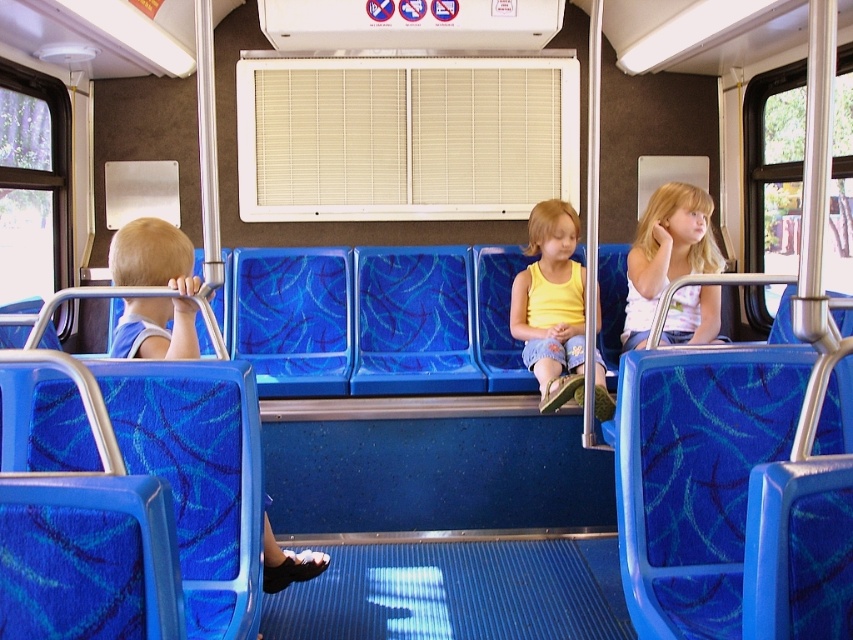
Question: Which object is the closest to the light blue fabric seat at left?

Choices:
 (A) yellow cotton tank top at center
 (B) light blue fabric dress at right

Answer: (A)

Question: Where is yellow cotton tank top at center located in relation to light blue fabric dress at right in the image?

Choices:
 (A) right
 (B) left

Answer: (B)

Question: Is yellow cotton tank top at center further to the viewer compared to light blue fabric seat at left?

Choices:
 (A) no
 (B) yes

Answer: (B)

Question: Among these objects, which one is farthest from the camera?

Choices:
 (A) light blue fabric seat at left
 (B) light blue fabric dress at right

Answer: (B)

Question: Can you confirm if yellow cotton tank top at center is thinner than light blue fabric seat at left?

Choices:
 (A) no
 (B) yes

Answer: (A)

Question: Which object appears farthest from the camera in this image?

Choices:
 (A) light blue fabric dress at right
 (B) yellow cotton tank top at center

Answer: (A)